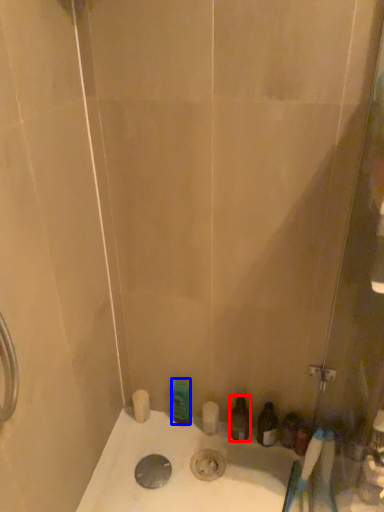
Question: Which of the following is the closest to the observer, toiletry (highlighted by a red box) or toiletry (highlighted by a blue box)?

Choices:
 (A) toiletry
 (B) toiletry

Answer: (A)